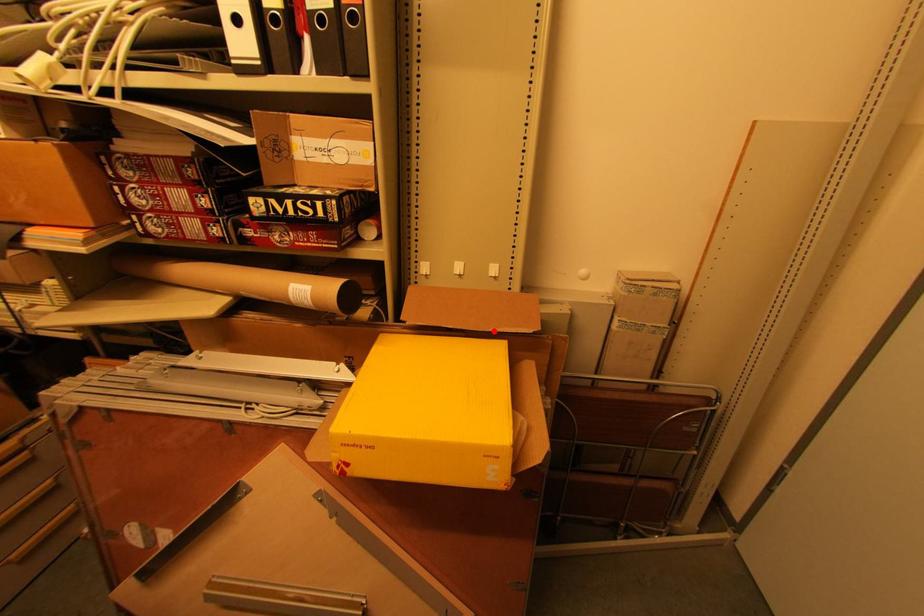
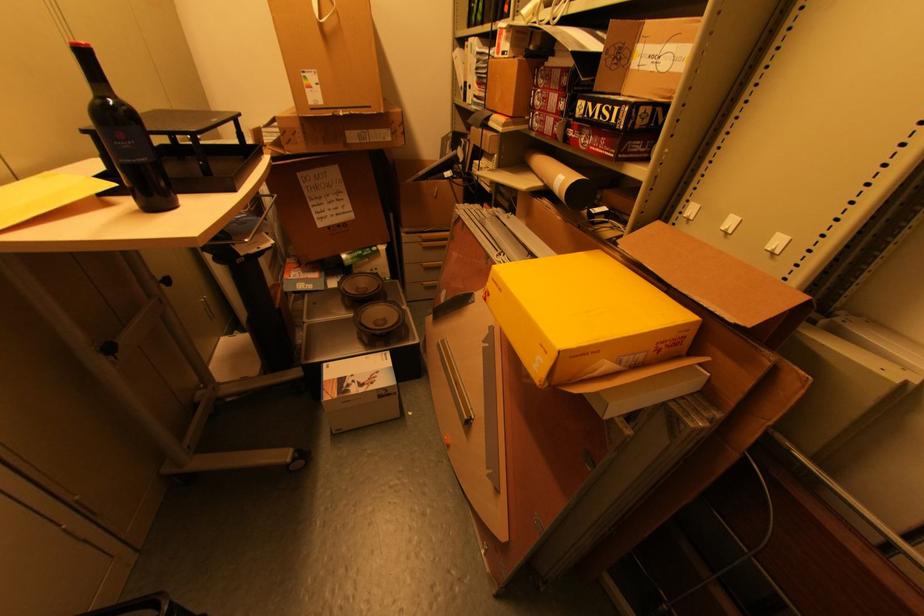
Find the pixel in the second image that matches the highlighted location in the first image.

(688, 294)